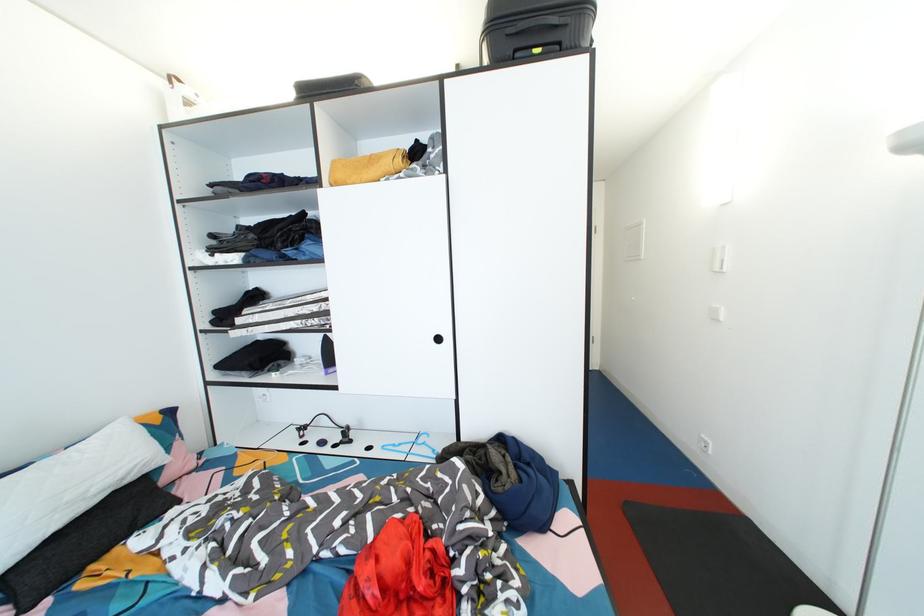
Where would you grasp the white pillow? Please return your answer as a coordinate pair (x, y).

(70, 484)